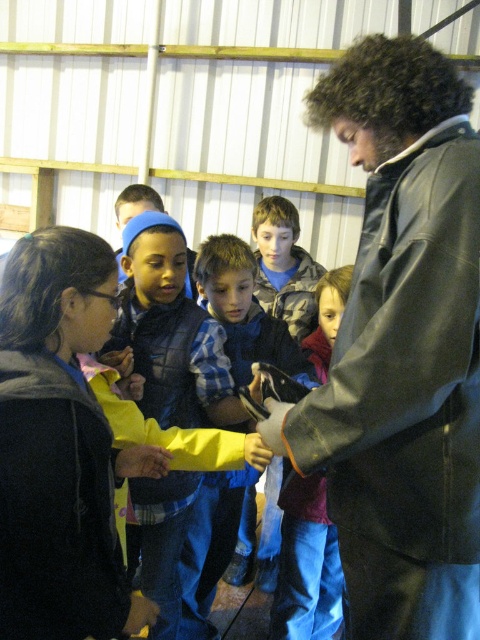
You are a photographer trying to capture a clear shot of both the black leather jacket at center and the blue plaid shirt at center. Since you can only focus on one subject at a time, which one should you choose to ensure the other remains in the background?

You should focus on the black leather jacket at center because it is closer to the viewer than the blue plaid shirt at center, so the blue plaid shirt at center will naturally be in the background.

You are a photographer trying to capture a group photo of the children and the adult. The blue plaid shirt at center and the camouflage jacket at center are both in the frame. Which of these two items should you focus on to ensure they are both in focus, considering their positions relative to the camera?

The blue plaid shirt at center is wider than the camouflage jacket at center, so focusing on the blue plaid shirt at center will ensure both are in focus as it covers a larger area in the frame.